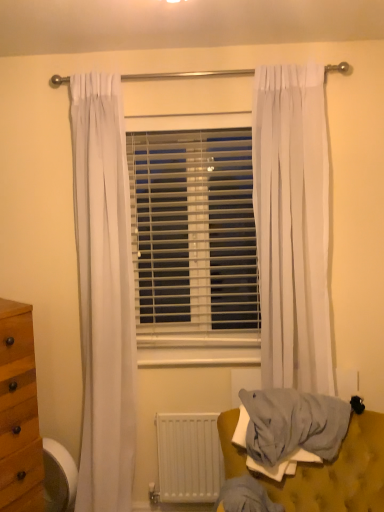
Question: In the image, is white matte radiator at lower center positioned in front of or behind wooden swivel chair at lower left?

Choices:
 (A) behind
 (B) front

Answer: (A)

Question: In terms of size, does white matte radiator at lower center appear bigger or smaller than wooden swivel chair at lower left?

Choices:
 (A) small
 (B) big

Answer: (B)

Question: Estimate the real-world distances between objects in this image. Which object is closer to the white sheer curtain at right?

Choices:
 (A) white matte radiator at lower center
 (B) light gray fabric at lower right
 (C) white plastic blinds at center
 (D) wooden swivel chair at lower left

Answer: (C)

Question: Estimate the real-world distances between objects in this image. Which object is farther from the wooden swivel chair at lower left?

Choices:
 (A) white sheer curtain at right
 (B) white plastic blinds at center
 (C) light gray fabric at lower right
 (D) white matte radiator at lower center

Answer: (A)